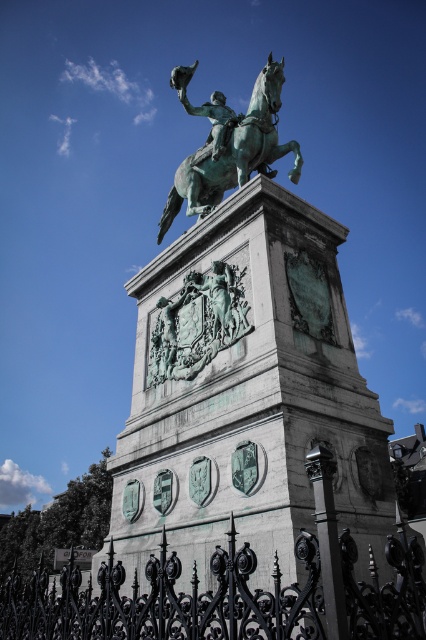
Question: Is green patina statue at center closer to camera compared to green patina bas-relief at center?

Choices:
 (A) no
 (B) yes

Answer: (B)

Question: Among these objects, which one is nearest to the camera?

Choices:
 (A) green patina statue at center
 (B) green patina bas-relief at center
 (C) green patina horse at center

Answer: (A)

Question: Can you confirm if green patina horse at center is smaller than green patina bas-relief at center?

Choices:
 (A) yes
 (B) no

Answer: (B)

Question: Estimate the real-world distances between objects in this image. Which object is farther from the green patina statue at center?

Choices:
 (A) green patina bas-relief at center
 (B) green patina horse at center
 (C) black wrought iron fence at lower center

Answer: (B)

Question: In this image, where is green patina statue at center located relative to black wrought iron fence at lower center?

Choices:
 (A) above
 (B) below

Answer: (A)

Question: Which object is positioned farthest from the green patina bas-relief at center?

Choices:
 (A) green patina statue at center
 (B) green patina horse at center
 (C) black wrought iron fence at lower center

Answer: (C)